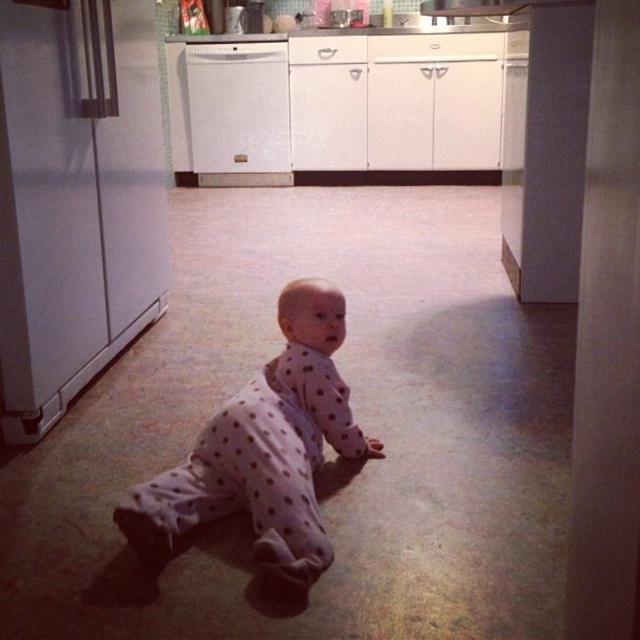
Is point (296, 465) positioned after point (221, 163)?

That is False.

What do you see at coordinates (262, 449) in the screenshot?
I see `white polka dot onesie at center` at bounding box center [262, 449].

Where is `white polka dot onesie at center`? The image size is (640, 640). white polka dot onesie at center is located at coordinates (262, 449).